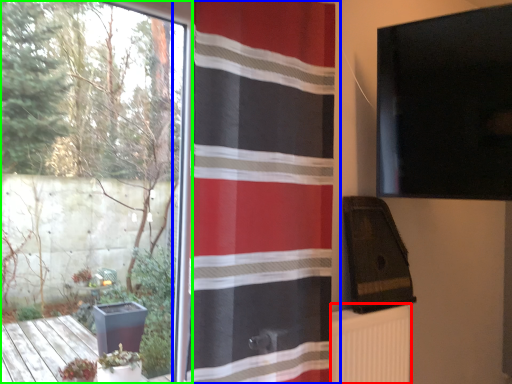
Question: Which object is the closest to the radiator (highlighted by a red box)? Choose among these: curtain (highlighted by a blue box) or window (highlighted by a green box).

Choices:
 (A) curtain
 (B) window

Answer: (A)